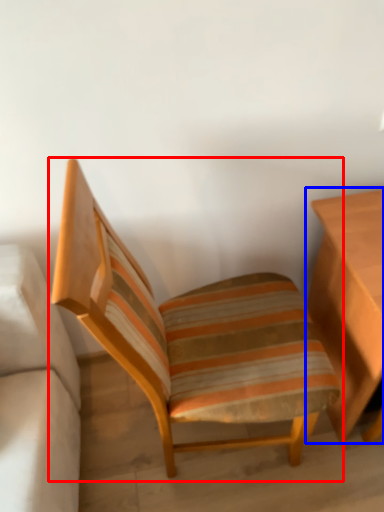
Question: Which object is further to the camera taking this photo, chair (highlighted by a red box) or table (highlighted by a blue box)?

Choices:
 (A) chair
 (B) table

Answer: (B)